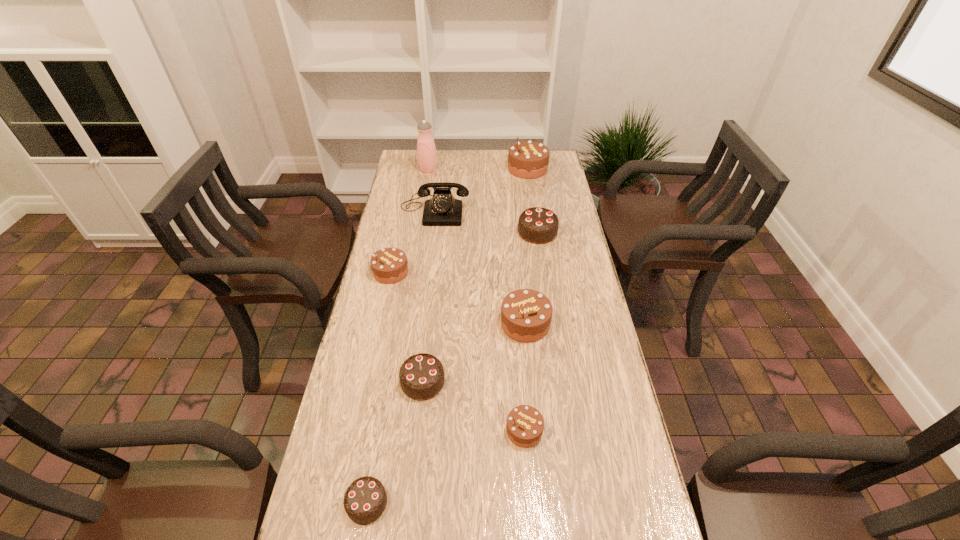
Where is `object that stands as the fifth closest to the farthest chocolate cake`? This screenshot has width=960, height=540. object that stands as the fifth closest to the farthest chocolate cake is located at coordinates (526, 314).

Locate which object is the fourth closest to the fifth nearest object. Please provide its 2D coordinates. Your answer should be formatted as a tuple, i.e. [(x, y)], where the tuple contains the x and y coordinates of a point satisfying the conditions above.

[(536, 225)]

Where is `the fifth closest chocolate cake relative to the tallest object`? The image size is (960, 540). the fifth closest chocolate cake relative to the tallest object is located at coordinates (421, 376).

In order to click on chocolate cake that can be found as the second closest to the smallest chocolate chocolate cake in this screenshot , I will do `click(525, 424)`.

I want to click on brown chocolate cake that stands as the closest to the third nearest brown chocolate cake, so click(526, 314).

I want to click on brown chocolate cake that is the third closest to the fifth farthest chocolate cake, so click(x=389, y=265).

Locate which chocolate chocolate cake ranks second in proximity to the thermos bottle. Please provide its 2D coordinates. Your answer should be formatted as a tuple, i.e. [(x, y)], where the tuple contains the x and y coordinates of a point satisfying the conditions above.

[(421, 376)]

Locate an element on the screen. The width and height of the screenshot is (960, 540). the third closest chocolate chocolate cake to the thermos bottle is located at coordinates (365, 500).

Find the location of a particular element. This screenshot has width=960, height=540. vacant point that satisfies the following two spatial constraints: 1. on the back side of the sixth nearest chocolate cake; 2. on the left side of the fourth farthest chocolate cake is located at coordinates (516, 232).

Find the location of a particular element. The height and width of the screenshot is (540, 960). vacant space that satisfies the following two spatial constraints: 1. on the front face of the telephone; 2. on the right side of the farthest chocolate chocolate cake is located at coordinates (432, 232).